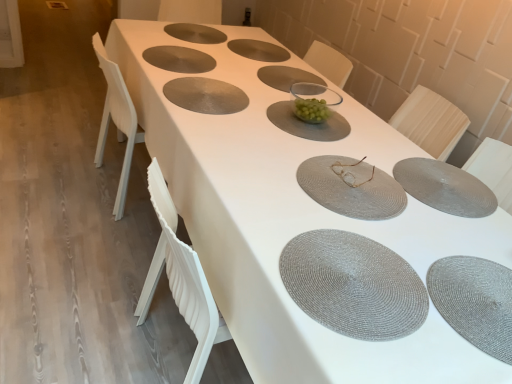
Find the location of `free space between matte gray placemat at upper center, the 7th tableware ordered from the bottom, and gray woven placemat at center`. free space between matte gray placemat at upper center, the 7th tableware ordered from the bottom, and gray woven placemat at center is located at coordinates (178, 72).